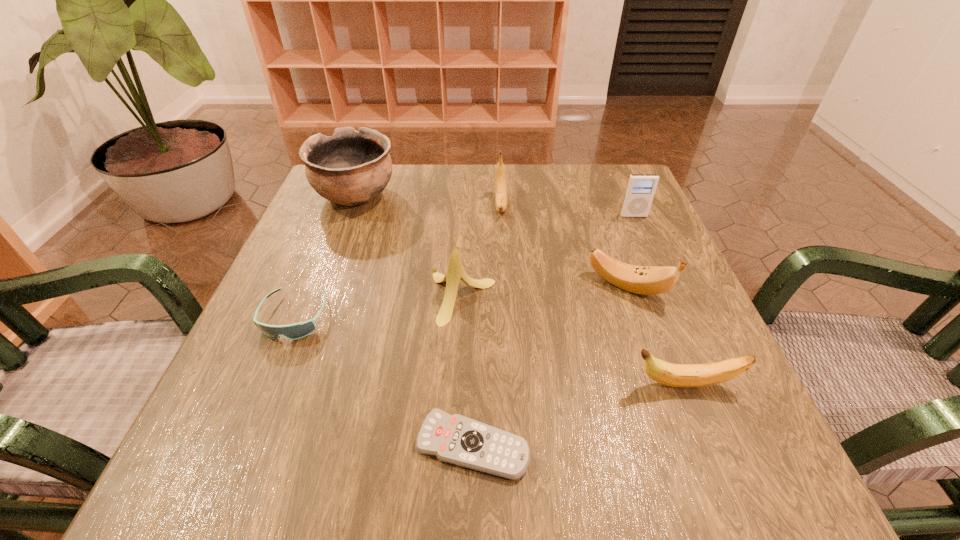
At what (x,y) coordinates should I click in order to perform the action: click on unoccupied position between the leftmost banana and the goggles. Please return your answer as a coordinate pair (x, y). The height and width of the screenshot is (540, 960). Looking at the image, I should click on (378, 307).

The height and width of the screenshot is (540, 960). What are the coordinates of `empty location between the seventh farthest object and the goggles` in the screenshot? It's located at [x=490, y=350].

Find the location of a particular element. The image size is (960, 540). vacant region between the leftmost banana and the nearest object is located at coordinates (468, 371).

Locate an element on the screen. free spot between the shortest object and the third tallest banana is located at coordinates (550, 366).

Find the location of a particular element. The image size is (960, 540). free space that is in between the shortest object and the second shortest banana is located at coordinates (550, 366).

This screenshot has width=960, height=540. I want to click on object that is the third closest to the leftmost banana, so click(x=299, y=330).

Identify which object is located as the seventh nearest to the second shortest banana. Please provide its 2D coordinates. Your answer should be formatted as a tuple, i.e. [(x, y)], where the tuple contains the x and y coordinates of a point satisfying the conditions above.

[(299, 330)]

You are a GUI agent. You are given a task and a screenshot of the screen. Output one action in this format:
    pyautogui.click(x=<x>, y=<y>)
    Task: Click on the banana that stands as the closest to the shortest banana
    The width and height of the screenshot is (960, 540).
    Given the screenshot: What is the action you would take?
    pyautogui.click(x=647, y=280)

Point out which banana is positioned as the nearest to the leftmost banana. Please provide its 2D coordinates. Your answer should be formatted as a tuple, i.e. [(x, y)], where the tuple contains the x and y coordinates of a point satisfying the conditions above.

[(501, 201)]

This screenshot has height=540, width=960. I want to click on free location that satisfies the following two spatial constraints: 1. at the start of the peel on the farthest banana; 2. on the left side of the third tallest banana, so click(x=506, y=286).